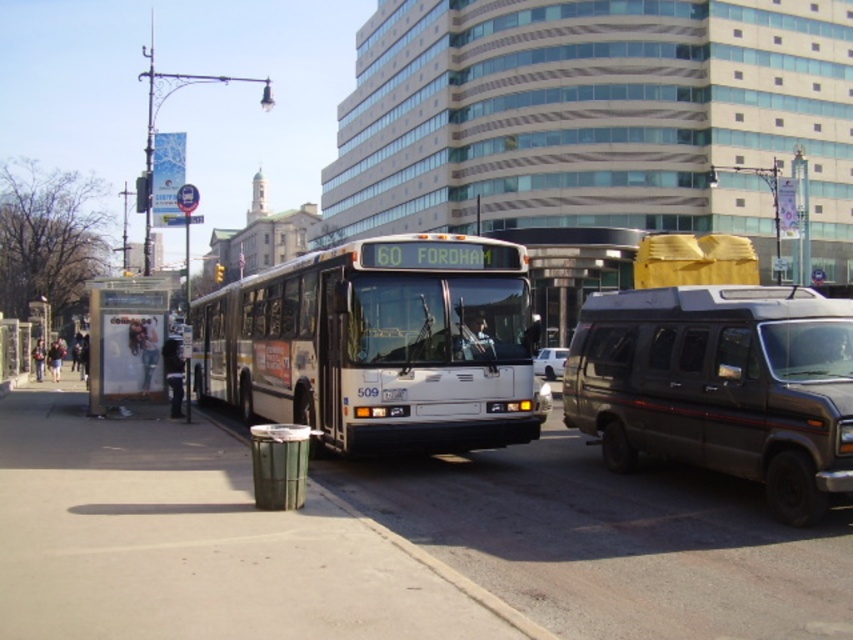
The image size is (853, 640). What do you see at coordinates (720, 385) in the screenshot?
I see `dark gray matte van at right` at bounding box center [720, 385].

Is dark gray matte van at right above denim jacket at lower left?

Indeed, dark gray matte van at right is positioned over denim jacket at lower left.

Which is behind, point (601, 419) or point (50, 348)?

Positioned behind is point (50, 348).

Image resolution: width=853 pixels, height=640 pixels. Identify the location of dark gray matte van at right. (720, 385).

Between point (91, 563) and point (584, 337), which one is positioned behind?

Positioned behind is point (584, 337).

In the scene shown: Does smooth concrete pavement at lower center appear on the left side of dark gray matte van at right?

Indeed, smooth concrete pavement at lower center is positioned on the left side of dark gray matte van at right.

This screenshot has width=853, height=640. In order to click on smooth concrete pavement at lower center in this screenshot , I will do `click(199, 541)`.

Find the location of a particular element. This screenshot has height=640, width=853. smooth concrete pavement at lower center is located at coordinates (199, 541).

Measure the distance between point (62, 552) and camera.

Point (62, 552) and camera are 6.18 meters apart from each other.

The image size is (853, 640). I want to click on smooth concrete pavement at lower center, so click(x=199, y=541).

I want to click on smooth concrete pavement at lower center, so click(199, 541).